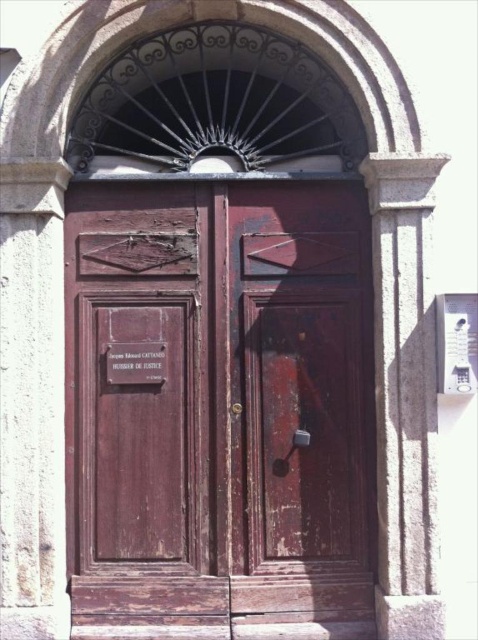
In the scene shown: You are standing in front of the double doors and notice two points marked on the stone archway. The first point is at coordinates point (79, 432) and the second is at point (122, 369). Which point is closer to you?

Point (79, 432) is further to the camera than point (122, 369), so the point closer to you is point (122, 369).